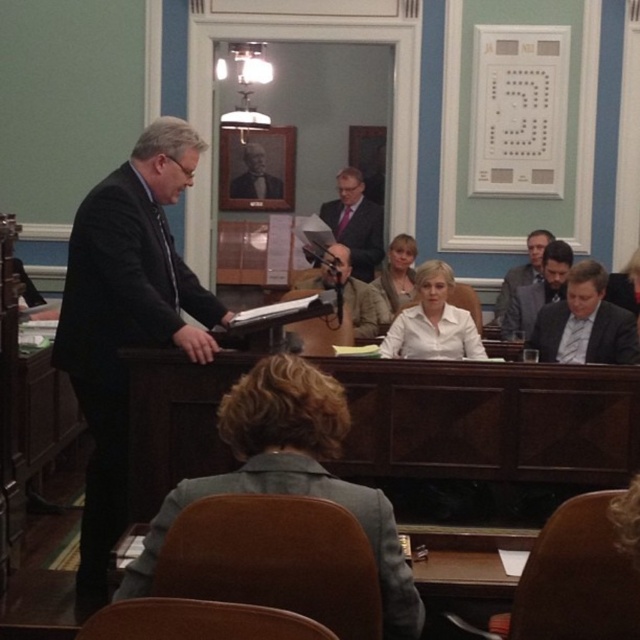
You are a photographer positioned at the front of the hearing room. You want to take a photo that includes both the speaker at the podium and the committee members seated across from him. Which of the two points, point (515, 276) or point (528, 282), is closer to your camera lens?

Point (528, 282) is closer to the camera lens because the description states that point (515, 276) is further away from the camera than point (528, 282).

You are standing in the legislative hearing room and need to place a small plant between the two points labeled point (166, 310) and point (369, 262). Which point should the plant be closer to to ensure it is placed in front of the speaker?

The plant should be placed closer to point (166, 310) because it is in front of point (369, 262) according to the spatial relationship described.